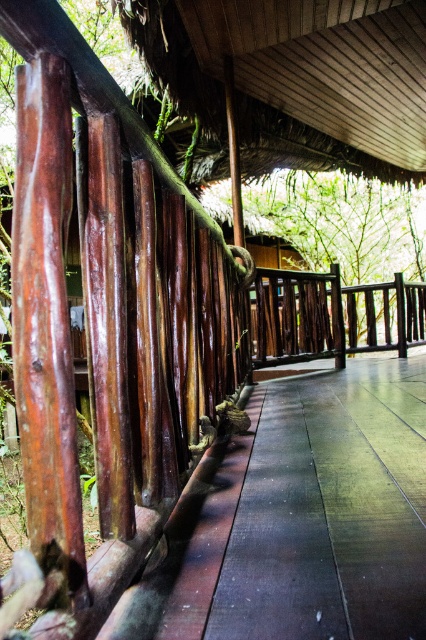
Question: Among these points, which one is nearest to the camera?

Choices:
 (A) (417, 113)
 (B) (319, 332)
 (C) (411, 220)

Answer: (B)

Question: Does brown wooden path at center have a larger size compared to green leafy tree at center?

Choices:
 (A) yes
 (B) no

Answer: (B)

Question: Among these points, which one is nearest to the camera?

Choices:
 (A) (356, 314)
 (B) (262, 180)
 (C) (244, 604)

Answer: (C)

Question: Does green leafy tree at center have a larger size compared to dark brown wood rail at center?

Choices:
 (A) no
 (B) yes

Answer: (B)

Question: Can you confirm if brown wooden path at center is positioned below brown/thatched roof at upper center?

Choices:
 (A) yes
 (B) no

Answer: (A)

Question: Which point is farther to the camera?

Choices:
 (A) dark brown wood rail at center
 (B) green leafy tree at center
 (C) brown wooden path at center
 (D) brown/thatched roof at upper center

Answer: (B)